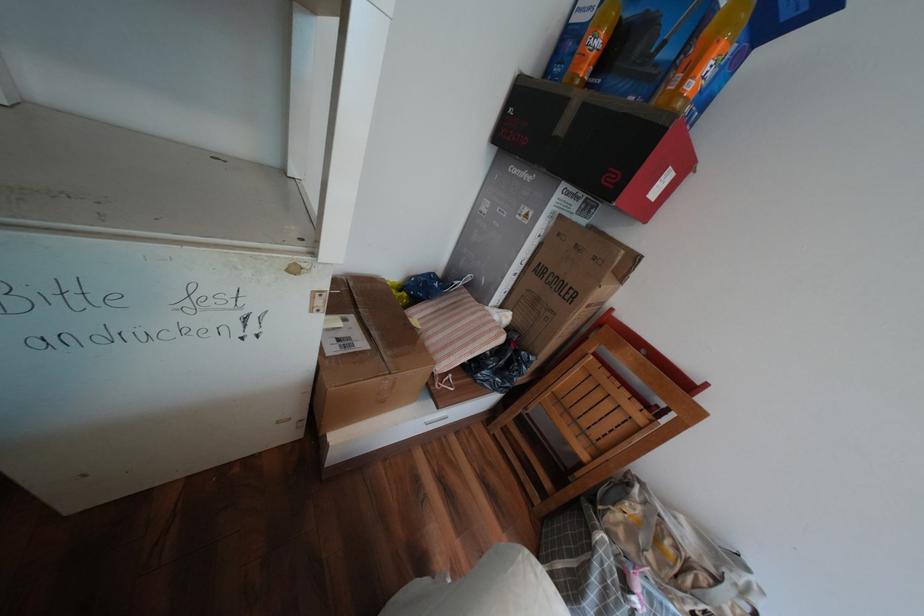
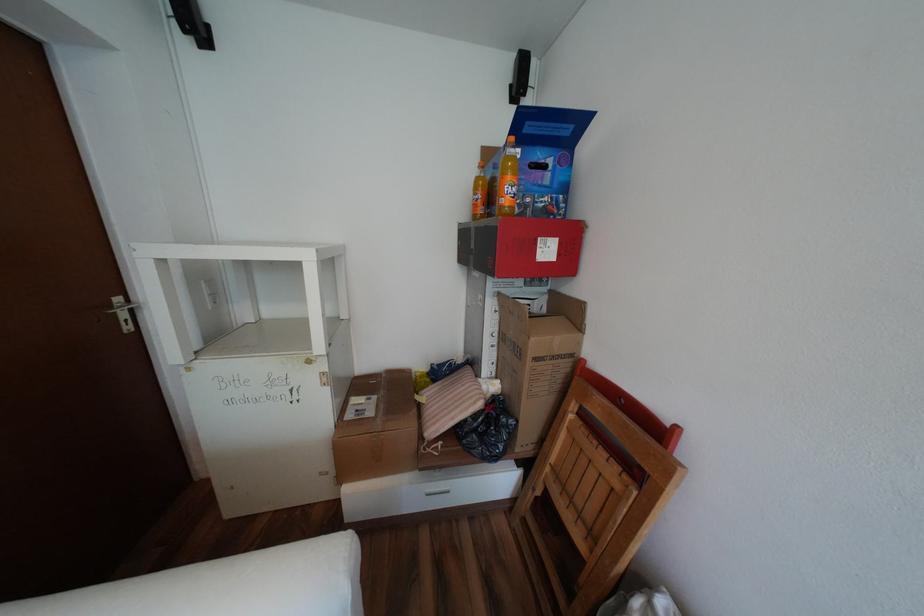
In the second image, find the point that corresponds to pixel 533 262 in the first image.

(505, 334)